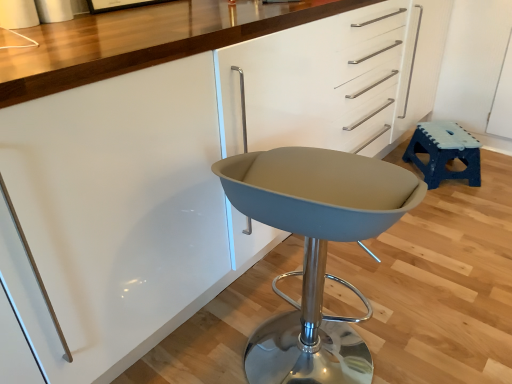
This screenshot has width=512, height=384. I want to click on vacant area situated to the left side of matte gray swivel chair at center, so click(202, 345).